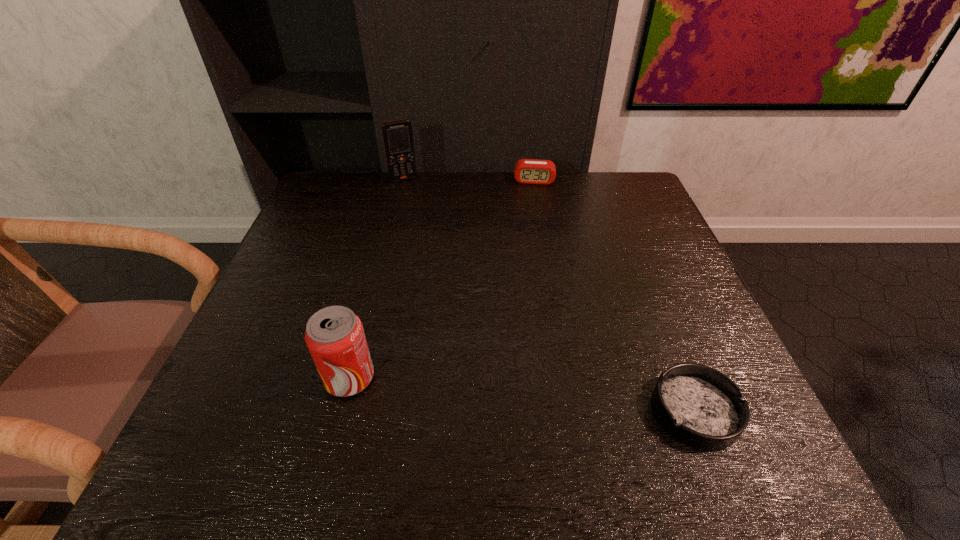
Where is `the third shortest object`? the third shortest object is located at coordinates point(334,335).

Where is `the rightmost object`? This screenshot has width=960, height=540. the rightmost object is located at coordinates (699, 406).

The height and width of the screenshot is (540, 960). What are the coordinates of `the shortest object` in the screenshot? It's located at (699, 406).

You are a GUI agent. You are given a task and a screenshot of the screen. Output one action in this format:
    pyautogui.click(x=<x>, y=<y>)
    Task: Click on the second shortest object
    Image resolution: width=960 pixels, height=540 pixels.
    Given the screenshot: What is the action you would take?
    pyautogui.click(x=528, y=171)

The height and width of the screenshot is (540, 960). What are the coordinates of `alarm clock` in the screenshot? It's located at (528, 171).

At what (x,y) coordinates should I click in order to perform the action: click on cellular telephone. Please return your answer as a coordinate pair (x, y). The width and height of the screenshot is (960, 540). Looking at the image, I should click on (398, 139).

Locate an element on the screen. The width and height of the screenshot is (960, 540). free space located on the back of the soda can is located at coordinates (363, 325).

Locate an element on the screen. This screenshot has width=960, height=540. free region located 0.380m on the back of the shortest object is located at coordinates (x=630, y=245).

Identify the location of vacant region located on the front-facing side of the second shortest object. (532, 253).

Where is `free space located on the front-facing side of the second shortest object`? free space located on the front-facing side of the second shortest object is located at coordinates (532, 243).